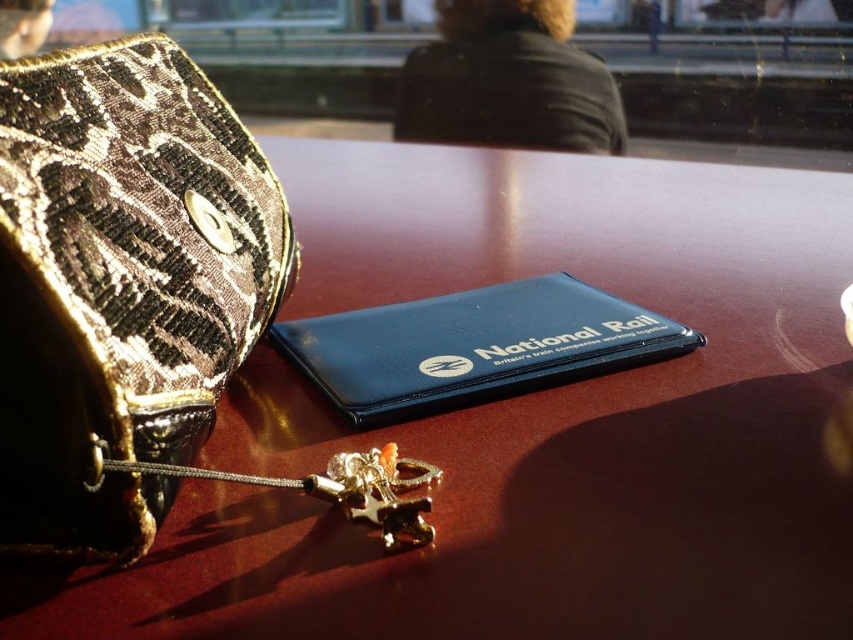
Between leather textured bag at left and gold metallic key at center, which one appears on the left side from the viewer's perspective?

From the viewer's perspective, leather textured bag at left appears more on the left side.

Can you confirm if leather textured bag at left is positioned to the left of gold metallic key at center?

Indeed, leather textured bag at left is positioned on the left side of gold metallic key at center.

Does point (13, 364) come behind point (306, 488)?

No, (13, 364) is closer to viewer.

Where is `leather textured bag at left`? Image resolution: width=853 pixels, height=640 pixels. leather textured bag at left is located at coordinates (120, 284).

Is leather textured bag at left positioned in front of matte black wallet at center?

Yes, it is.

Is leather textured bag at left shorter than matte black wallet at center?

No, leather textured bag at left is not shorter than matte black wallet at center.

Locate an element on the screen. leather textured bag at left is located at coordinates (120, 284).

Is matte black wallet at center to the right of gold metallic key at center from the viewer's perspective?

Indeed, matte black wallet at center is positioned on the right side of gold metallic key at center.

This screenshot has width=853, height=640. Describe the element at coordinates (473, 346) in the screenshot. I see `matte black wallet at center` at that location.

Does point (287, 326) come in front of point (372, 477)?

No, it is not.

Locate an element on the screen. The image size is (853, 640). matte black wallet at center is located at coordinates (473, 346).